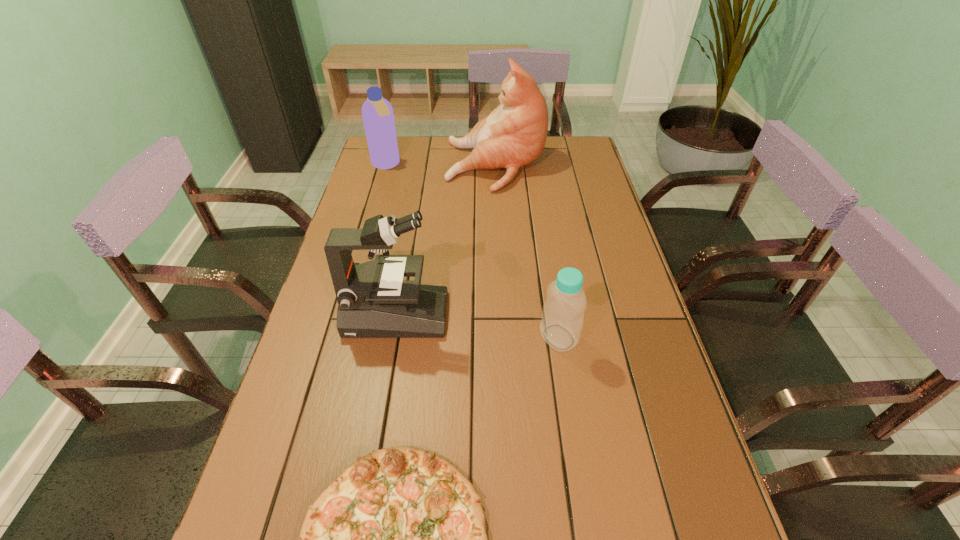
Locate an element on the screen. Image resolution: width=960 pixels, height=540 pixels. cat is located at coordinates (514, 134).

The width and height of the screenshot is (960, 540). Find the location of `microscope`. microscope is located at coordinates (374, 301).

Where is `shampoo`? shampoo is located at coordinates (377, 112).

What are the coordinates of `bottle` in the screenshot? It's located at (561, 324).

This screenshot has width=960, height=540. Identify the location of blank area located 0.130m on the face of the cat. (411, 166).

This screenshot has height=540, width=960. I want to click on blank area located on the face of the cat, so click(427, 166).

Find the location of a particular element. The image size is (960, 540). free space located on the face of the cat is located at coordinates (395, 166).

At what (x,y) coordinates should I click in order to perform the action: click on vacant space located 0.150m through the eyepieces of the microscope. Please return your answer as a coordinate pair (x, y). This screenshot has height=540, width=960. Looking at the image, I should click on (505, 315).

You are a GUI agent. You are given a task and a screenshot of the screen. Output one action in this format:
    pyautogui.click(x=<x>, y=<y>)
    Task: Click on the free space located on the front of the shampoo
    The image size is (960, 540).
    Given the screenshot: What is the action you would take?
    pyautogui.click(x=379, y=187)

Where is `free space located on the left of the bottle`? Image resolution: width=960 pixels, height=540 pixels. free space located on the left of the bottle is located at coordinates (388, 337).